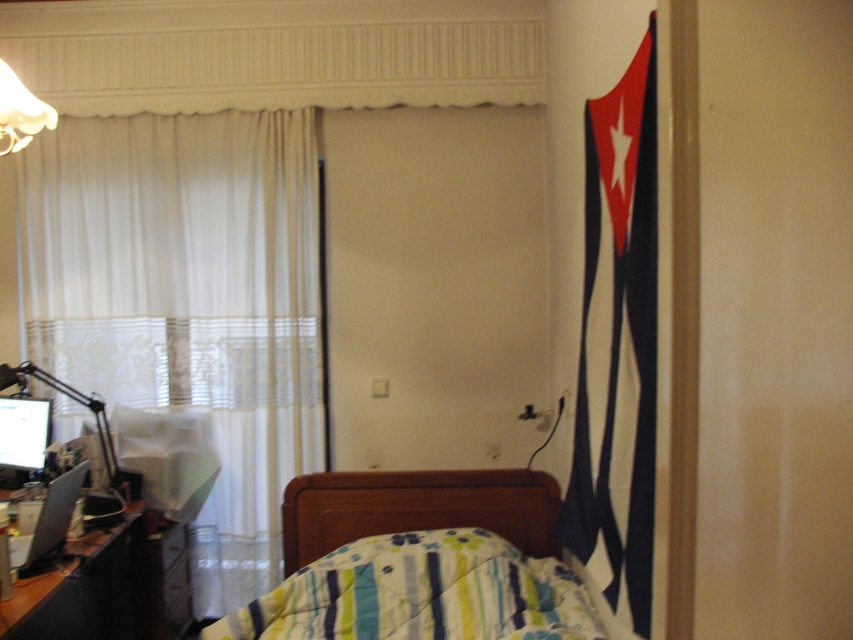
Question: Which point appears closest to the camera in this image?

Choices:
 (A) (18, 88)
 (B) (39, 513)

Answer: (A)

Question: Which is nearer to the white sheer curtain at left?

Choices:
 (A) wooden desk at lower left
 (B) matte black laptop at left
 (C) white matte lampshade at upper left
 (D) matte black monitor at left

Answer: (D)

Question: Among these objects, which one is farthest from the camera?

Choices:
 (A) white matte lampshade at upper left
 (B) matte black laptop at left
 (C) matte black monitor at left
 (D) wooden desk at lower left

Answer: (C)

Question: Does wooden desk at lower left have a greater width compared to matte black monitor at left?

Choices:
 (A) yes
 (B) no

Answer: (B)

Question: Where is wooden desk at lower left located in relation to matte black monitor at left in the image?

Choices:
 (A) below
 (B) above

Answer: (A)

Question: Is wooden desk at lower left positioned behind matte black lamp at left?

Choices:
 (A) yes
 (B) no

Answer: (B)